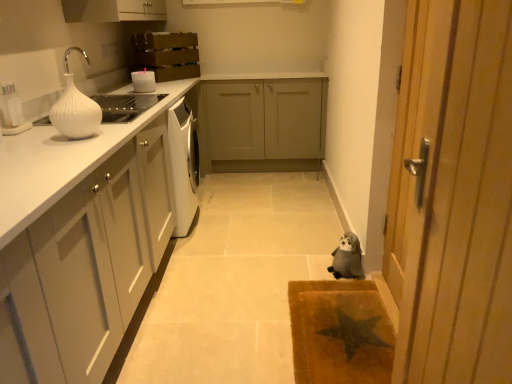
Question: Is white glossy candle at upper center, the 1th appliance when ordered from back to front, further to camera compared to white glossy knife block at upper left, the 2th appliance from the top?

Choices:
 (A) yes
 (B) no

Answer: (A)

Question: Considering the relative positions of white glossy candle at upper center, the first appliance in the right-to-left sequence, and white glossy knife block at upper left, the 2th appliance from the top, in the image provided, is white glossy candle at upper center, the first appliance in the right-to-left sequence, to the right of white glossy knife block at upper left, the 2th appliance from the top, from the viewer's perspective?

Choices:
 (A) no
 (B) yes

Answer: (B)

Question: Does white glossy candle at upper center, which ranks as the first appliance in top-to-bottom order, have a greater width compared to white glossy knife block at upper left, acting as the 2th appliance starting from the right?

Choices:
 (A) no
 (B) yes

Answer: (B)

Question: Does white glossy candle at upper center, the 2th appliance in the left-to-right sequence, appear on the left side of white glossy knife block at upper left, which ranks as the 1th appliance in front-to-back order?

Choices:
 (A) yes
 (B) no

Answer: (B)

Question: From a real-world perspective, is white glossy candle at upper center, the second appliance when ordered from bottom to top, under white glossy knife block at upper left, which ranks as the 1th appliance in front-to-back order?

Choices:
 (A) yes
 (B) no

Answer: (A)

Question: Would you consider white glossy candle at upper center, the 2th appliance in the left-to-right sequence, to be distant from white glossy knife block at upper left, the 1th appliance positioned from the left?

Choices:
 (A) no
 (B) yes

Answer: (B)

Question: Does wooden door at right appear on the left side of white matte cabinet at left, the 3th cabinetry viewed from the back?

Choices:
 (A) yes
 (B) no

Answer: (B)

Question: Is wooden door at right completely or partially outside of white matte cabinet at left, acting as the 1th cabinetry starting from the front?

Choices:
 (A) no
 (B) yes

Answer: (B)

Question: Is wooden door at right wider than white matte cabinet at left, the 3th cabinetry viewed from the back?

Choices:
 (A) yes
 (B) no

Answer: (B)

Question: Considering the relative sizes of wooden door at right and white matte cabinet at left, acting as the 1th cabinetry starting from the front, in the image provided, is wooden door at right thinner than white matte cabinet at left, acting as the 1th cabinetry starting from the front,?

Choices:
 (A) no
 (B) yes

Answer: (B)

Question: Considering the relative sizes of wooden door at right and white matte cabinet at left, the 3th cabinetry viewed from the back, in the image provided, is wooden door at right taller than white matte cabinet at left, the 3th cabinetry viewed from the back,?

Choices:
 (A) no
 (B) yes

Answer: (B)

Question: Considering the relative positions of wooden door at right and white matte cabinet at left, acting as the 1th cabinetry starting from the front, in the image provided, is wooden door at right to the right of white matte cabinet at left, acting as the 1th cabinetry starting from the front, from the viewer's perspective?

Choices:
 (A) yes
 (B) no

Answer: (A)

Question: Can you confirm if fluffy gray stuffed animal at lower right is positioned to the right of matte gray cabinets at center, the 1th cabinetry when ordered from back to front?

Choices:
 (A) no
 (B) yes

Answer: (B)